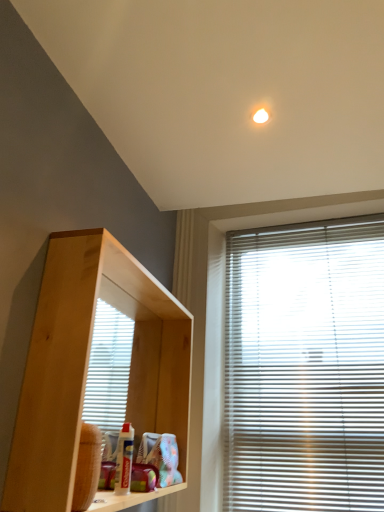
Question: Relative to white plastic blinds at right, is natural wood shelf at center in front or behind?

Choices:
 (A) front
 (B) behind

Answer: (A)

Question: Visually, is natural wood shelf at center positioned to the left or to the right of white plastic blinds at right?

Choices:
 (A) right
 (B) left

Answer: (B)

Question: In terms of height, does natural wood shelf at center look taller or shorter compared to white plastic blinds at right?

Choices:
 (A) tall
 (B) short

Answer: (B)

Question: Would you say white plastic blinds at right is to the left or to the right of natural wood shelf at center in the picture?

Choices:
 (A) right
 (B) left

Answer: (A)

Question: Is white plastic blinds at right in front of or behind natural wood shelf at center in the image?

Choices:
 (A) behind
 (B) front

Answer: (A)

Question: From the image's perspective, is white plastic blinds at right positioned above or below natural wood shelf at center?

Choices:
 (A) below
 (B) above

Answer: (A)

Question: Is white plastic blinds at right bigger or smaller than natural wood shelf at center?

Choices:
 (A) big
 (B) small

Answer: (B)